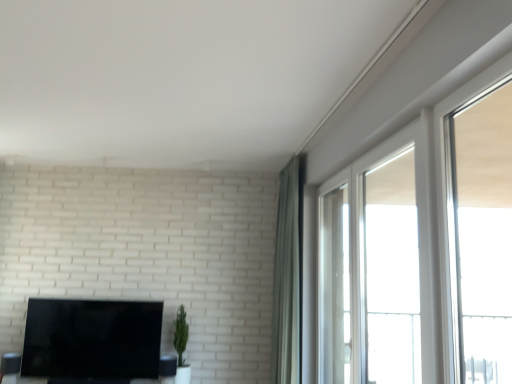
This screenshot has height=384, width=512. Describe the element at coordinates (476, 224) in the screenshot. I see `transparent glass window at right, the third window from the back` at that location.

What do you see at coordinates (391, 272) in the screenshot? I see `clear glass window at right, positioned as the third window in front-to-back order` at bounding box center [391, 272].

Identify the location of green matte plant at center. (181, 334).

At what (x,y) coordinates should I click in order to perform the action: click on transparent glass window at right, the third window from the back. Please return your answer as a coordinate pair (x, y). The image size is (512, 384). Looking at the image, I should click on (476, 224).

Does clear glass window at right, positioned as the third window in front-to-back order, have a lesser width compared to transparent glass window at right, the third window from the back?

Yes, clear glass window at right, positioned as the third window in front-to-back order, is thinner than transparent glass window at right, the third window from the back.

Between clear glass window at right, positioned as the third window in front-to-back order, and transparent glass window at right, the third window from the back, which one has more height?

clear glass window at right, positioned as the third window in front-to-back order, is taller.

From the image's perspective, which object appears higher, clear glass window at right, the first window in the back-to-front sequence, or transparent glass window at right, the 1th window from the front?

transparent glass window at right, the 1th window from the front, is shown above in the image.

Can you confirm if clear glass window at right, the first window in the back-to-front sequence, is bigger than transparent glass window at right, the 1th window from the front?

Yes, clear glass window at right, the first window in the back-to-front sequence, is bigger than transparent glass window at right, the 1th window from the front.

Is transparent glass window at right, the 1th window from the front, taller than black glossy tv at lower left?

Indeed, transparent glass window at right, the 1th window from the front, has a greater height compared to black glossy tv at lower left.

From a real-world perspective, between transparent glass window at right, the third window from the back, and black glossy tv at lower left, who is vertically lower?

black glossy tv at lower left, from a real-world perspective.

From the image's perspective, which object appears higher, transparent glass window at right, the 1th window from the front, or black glossy tv at lower left?

transparent glass window at right, the 1th window from the front, is shown above in the image.

In the image, is clear glass window at upper right, the 2th window in the front-to-back sequence, positioned in front of or behind green matte plant at center?

Clearly, clear glass window at upper right, the 2th window in the front-to-back sequence, is in front of green matte plant at center.

Where is `the 1st window positioned above the green matte plant at center (from the image's perspective)`? the 1st window positioned above the green matte plant at center (from the image's perspective) is located at coordinates (378, 265).

Considering the sizes of objects clear glass window at upper right, the 2th window in the front-to-back sequence, and green matte plant at center in the image provided, who is taller, clear glass window at upper right, the 2th window in the front-to-back sequence, or green matte plant at center?

Standing taller between the two is clear glass window at upper right, the 2th window in the front-to-back sequence.

Does black glossy tv at lower left turn towards transparent glass window at right, the 1th window from the front?

No, black glossy tv at lower left does not turn towards transparent glass window at right, the 1th window from the front.

From a real-world perspective, is black glossy tv at lower left below transparent glass window at right, the third window from the back?

Yes, from a real-world perspective, black glossy tv at lower left is under transparent glass window at right, the third window from the back.

Is black glossy tv at lower left with transparent glass window at right, the third window from the back?

black glossy tv at lower left and transparent glass window at right, the third window from the back, are clearly separated.

From a real-world perspective, is black glossy tv at lower left located beneath green fabric curtain at upper right?

Correct, in the physical world, black glossy tv at lower left is lower than green fabric curtain at upper right.

From the image's perspective, is black glossy tv at lower left located above green fabric curtain at upper right?

No, from the image's perspective, black glossy tv at lower left is not above green fabric curtain at upper right.

Can you tell me how much black glossy tv at lower left and green fabric curtain at upper right differ in facing direction?

90.1 degrees separate the facing orientations of black glossy tv at lower left and green fabric curtain at upper right.

How much distance is there between black glossy tv at lower left and green fabric curtain at upper right?

A distance of 1.63 meters exists between black glossy tv at lower left and green fabric curtain at upper right.

Is clear glass window at right, the first window in the back-to-front sequence, to the left of green matte plant at center from the viewer's perspective?

No.

From a real-world perspective, is clear glass window at right, the first window in the back-to-front sequence, below green matte plant at center?

Incorrect, from a real-world perspective, clear glass window at right, the first window in the back-to-front sequence, is higher than green matte plant at center.

Are clear glass window at right, the first window in the back-to-front sequence, and green matte plant at center far apart?

clear glass window at right, the first window in the back-to-front sequence, is positioned a significant distance from green matte plant at center.

Is green matte plant at center at the left side of green fabric curtain at upper right?

Yes, green matte plant at center is to the left of green fabric curtain at upper right.

From a real-world perspective, relative to green fabric curtain at upper right, is green matte plant at center vertically above or below?

In terms of real-world spatial position, green matte plant at center is below green fabric curtain at upper right.

Can you confirm if green matte plant at center is shorter than green fabric curtain at upper right?

Correct, green matte plant at center is not as tall as green fabric curtain at upper right.

Where is `plant below the green fabric curtain at upper right (from a real-world perspective)`? The image size is (512, 384). plant below the green fabric curtain at upper right (from a real-world perspective) is located at coordinates (181, 334).

The image size is (512, 384). Find the location of `the 2nd window behind when counting from the transparent glass window at right, the 1th window from the front`. the 2nd window behind when counting from the transparent glass window at right, the 1th window from the front is located at coordinates (391, 272).

This screenshot has width=512, height=384. What are the coordinates of `television on the left of transparent glass window at right, the third window from the back` in the screenshot? It's located at (92, 340).

Looking at the image, which one is located further to transparent glass window at right, the third window from the back, green matte plant at center or black glossy tv at lower left?

The object further to transparent glass window at right, the third window from the back, is black glossy tv at lower left.

Looking at the image, which one is located further to clear glass window at upper right, the 2th window in the front-to-back sequence, green matte plant at center or black glossy tv at lower left?

The object further to clear glass window at upper right, the 2th window in the front-to-back sequence, is black glossy tv at lower left.

Based on their spatial positions, is green matte plant at center or clear glass window at upper right, the 2th window viewed from the back, further from black glossy tv at lower left?

clear glass window at upper right, the 2th window viewed from the back, is positioned further to the anchor black glossy tv at lower left.

Which object lies nearer to the anchor point black glossy tv at lower left, clear glass window at right, the first window in the back-to-front sequence, or green fabric curtain at upper right?

green fabric curtain at upper right is closer to black glossy tv at lower left.

Which object lies nearer to the anchor point clear glass window at right, positioned as the third window in front-to-back order, clear glass window at upper right, the 2th window in the front-to-back sequence, or green matte plant at center?

Among the two, clear glass window at upper right, the 2th window in the front-to-back sequence, is located nearer to clear glass window at right, positioned as the third window in front-to-back order.

Which object lies further to the anchor point green matte plant at center, black glossy tv at lower left or transparent glass window at right, the third window from the back?

Based on the image, transparent glass window at right, the third window from the back, appears to be further to green matte plant at center.

Which object lies further to the anchor point green fabric curtain at upper right, clear glass window at right, the first window in the back-to-front sequence, or clear glass window at upper right, the 2th window viewed from the back?

clear glass window at upper right, the 2th window viewed from the back, is further to green fabric curtain at upper right.

Considering their positions, is transparent glass window at right, the third window from the back, positioned closer to clear glass window at right, the first window in the back-to-front sequence, than clear glass window at upper right, the 2th window viewed from the back?

clear glass window at upper right, the 2th window viewed from the back, lies closer to clear glass window at right, the first window in the back-to-front sequence, than the other object.

Where is `curtain situated between black glossy tv at lower left and clear glass window at right, positioned as the third window in front-to-back order, from left to right`? curtain situated between black glossy tv at lower left and clear glass window at right, positioned as the third window in front-to-back order, from left to right is located at coordinates (288, 277).

Locate an element on the screen. The width and height of the screenshot is (512, 384). window located between transparent glass window at right, the 1th window from the front, and clear glass window at right, positioned as the third window in front-to-back order, in the depth direction is located at coordinates (378, 265).

Locate an element on the screen. The image size is (512, 384). curtain between clear glass window at right, positioned as the third window in front-to-back order, and green matte plant at center from front to back is located at coordinates (288, 277).

In order to click on window between black glossy tv at lower left and clear glass window at right, the first window in the back-to-front sequence, from left to right in this screenshot , I will do `click(378, 265)`.